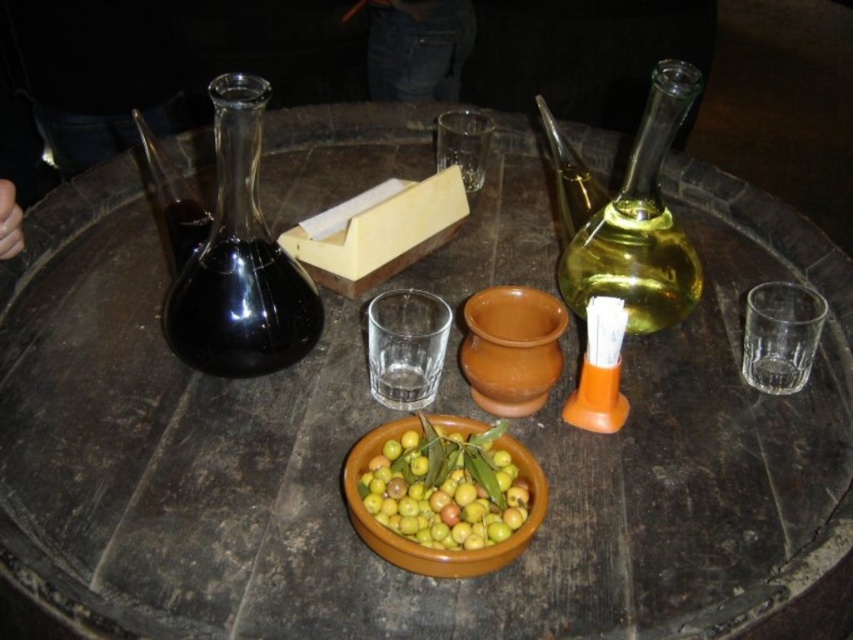
Locate an element on the screen. green matte bowl at center is located at coordinates (445, 486).

Which is below, green matte bowl at center or terracotta clay bowl at center?

Positioned lower is green matte bowl at center.

Between point (430, 500) and point (538, 380), which one is positioned in front?

Point (430, 500)

You are a GUI agent. You are given a task and a screenshot of the screen. Output one action in this format:
    pyautogui.click(x=<x>, y=<y>)
    Task: Click on the green matte bowl at center
    This screenshot has width=853, height=640.
    Given the screenshot: What is the action you would take?
    pyautogui.click(x=445, y=486)

Can you confirm if green glass bottle at upper right is smaller than green matte bowl at center?

Incorrect, green glass bottle at upper right is not smaller in size than green matte bowl at center.

Who is higher up, green glass bottle at upper right or green matte bowl at center?

green glass bottle at upper right is above.

Who is more distant from viewer, (695, 269) or (366, 508)?

The point (695, 269) is more distant.

Where is `green glass bottle at upper right`? This screenshot has width=853, height=640. green glass bottle at upper right is located at coordinates (640, 224).

Does point (218, 266) come in front of point (143, 150)?

Yes, it is in front of point (143, 150).

Does transparent glass carafe at left have a greater width compared to translucent glass carafe at upper left?

Correct, the width of transparent glass carafe at left exceeds that of translucent glass carafe at upper left.

You are a GUI agent. You are given a task and a screenshot of the screen. Output one action in this format:
    pyautogui.click(x=<x>, y=<y>)
    Task: Click on the transparent glass carafe at left
    
    Given the screenshot: What is the action you would take?
    pyautogui.click(x=241, y=259)

What are the coordinates of `transparent glass carafe at left` in the screenshot? It's located at (241, 259).